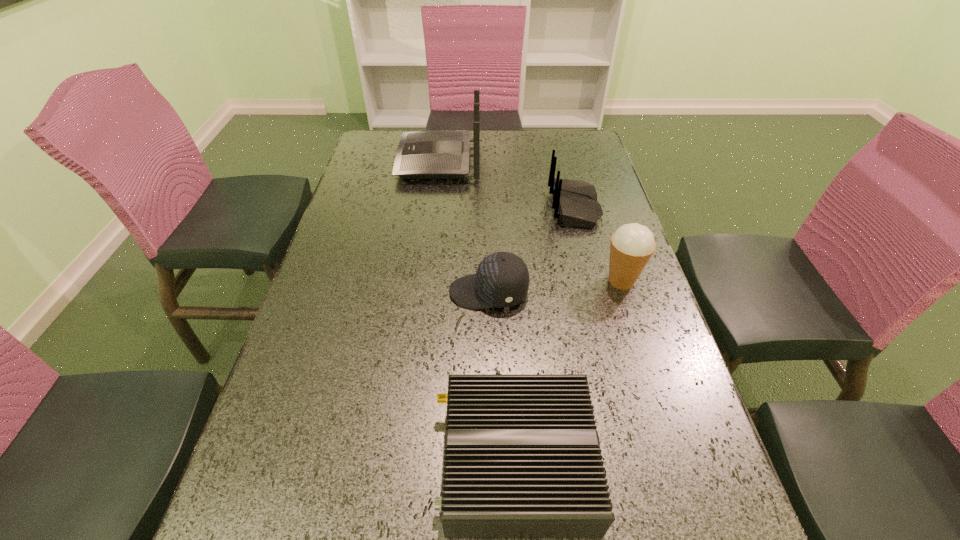
The width and height of the screenshot is (960, 540). Identify the location of vacant space that is in between the nearest object and the tallest router. (478, 311).

Image resolution: width=960 pixels, height=540 pixels. Identify the location of free area in between the icecream and the farthest object. (530, 221).

The width and height of the screenshot is (960, 540). I want to click on unoccupied position between the fourth nearest object and the baseball cap, so click(x=532, y=249).

Identify the location of free spot between the baseball cap and the farthest object. The width and height of the screenshot is (960, 540). (464, 226).

The height and width of the screenshot is (540, 960). I want to click on free space between the icecream and the third shortest object, so click(x=598, y=244).

Where is `free point between the baseball cap and the tallest router`? free point between the baseball cap and the tallest router is located at coordinates (464, 226).

At what (x,y) coordinates should I click in order to perform the action: click on free spot between the second farthest object and the nearest object. Please return your answer as a coordinate pair (x, y). Looking at the image, I should click on (545, 334).

Locate an element on the screen. The width and height of the screenshot is (960, 540). free space between the farthest object and the shortest router is located at coordinates (478, 311).

You are a GUI agent. You are given a task and a screenshot of the screen. Output one action in this format:
    pyautogui.click(x=<x>, y=<y>)
    Task: Click on the unoccupied area between the baseball cap and the icecream
    This screenshot has height=540, width=960.
    Given the screenshot: What is the action you would take?
    [x=555, y=287]

Find the location of `object that is the second nearest to the rightmost router`. object that is the second nearest to the rightmost router is located at coordinates (502, 279).